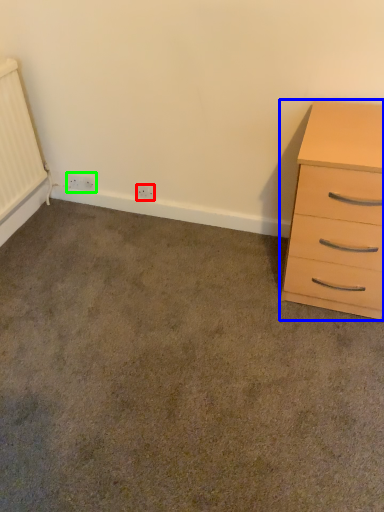
Question: Which object is positioned farthest from electric outlet (highlighted by a red box)? Select from chest of drawers (highlighted by a blue box) and electric outlet (highlighted by a green box).

Choices:
 (A) chest of drawers
 (B) electric outlet

Answer: (A)